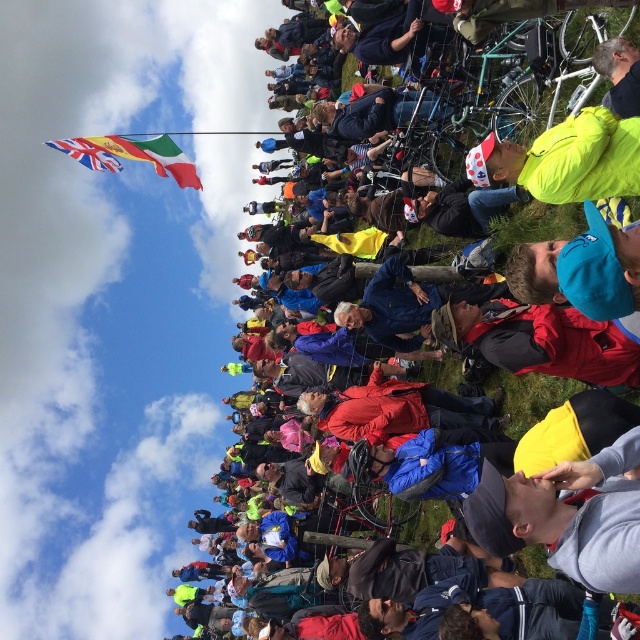
Locate an element on the screen. Image resolution: width=640 pixels, height=640 pixels. blue fabric jacket at upper center is located at coordinates (115, 385).

Does blue fabric jacket at upper center have a greater height compared to neon yellow jacket at center?

Yes, blue fabric jacket at upper center is taller than neon yellow jacket at center.

Between point (225, 198) and point (588, 156), which one is positioned in front?

Point (588, 156)

In order to click on blue fabric jacket at upper center in this screenshot , I will do `click(115, 385)`.

Consider the image. Can you confirm if blue fabric jacket at upper center is positioned above union jack fabric flag at upper left?

Actually, blue fabric jacket at upper center is below union jack fabric flag at upper left.

What do you see at coordinates (115, 385) in the screenshot?
I see `blue fabric jacket at upper center` at bounding box center [115, 385].

Where is `blue fabric jacket at upper center`? blue fabric jacket at upper center is located at coordinates (115, 385).

Between blue fabric jacket at upper center and yellow jacket at upper right, which one is positioned higher?

Positioned higher is yellow jacket at upper right.

Does blue fabric jacket at upper center have a lesser width compared to yellow jacket at upper right?

Result: No, blue fabric jacket at upper center is not thinner than yellow jacket at upper right.

Describe the element at coordinates (115, 385) in the screenshot. I see `blue fabric jacket at upper center` at that location.

Locate an element on the screen. blue fabric jacket at upper center is located at coordinates (115, 385).